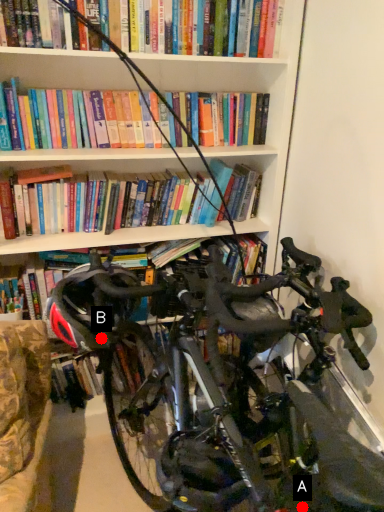
Question: Two points are circled on the image, labeled by A and B beside each circle. Which of the following is the closest to the observer?

Choices:
 (A) A is closer
 (B) B is closer

Answer: (A)